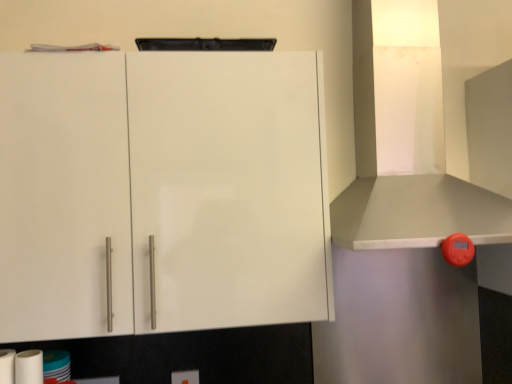
Question: Is white matte paper towel at lower left, the 2th paper towel in the right-to-left sequence, at the back of white matte paper towel at lower left, arranged as the first paper towel when viewed from the right?

Choices:
 (A) yes
 (B) no

Answer: (B)

Question: Is white matte paper towel at lower left, the 2th paper towel viewed from the left, further to the viewer compared to white matte paper towel at lower left, the 1th paper towel from the left?

Choices:
 (A) yes
 (B) no

Answer: (A)

Question: From a real-world perspective, is white matte paper towel at lower left, arranged as the first paper towel when viewed from the right, on white matte paper towel at lower left, the 1th paper towel from the left?

Choices:
 (A) no
 (B) yes

Answer: (B)

Question: Is white matte paper towel at lower left, the 2th paper towel viewed from the left, wider than white matte paper towel at lower left, the 1th paper towel from the left?

Choices:
 (A) no
 (B) yes

Answer: (A)

Question: Is white matte paper towel at lower left, arranged as the first paper towel when viewed from the right, far away from white matte paper towel at lower left, the 2th paper towel in the right-to-left sequence?

Choices:
 (A) no
 (B) yes

Answer: (A)

Question: Considering the relative positions of white matte paper towel at lower left, the 2th paper towel viewed from the left, and white matte paper towel at lower left, the 1th paper towel from the left, in the image provided, is white matte paper towel at lower left, the 2th paper towel viewed from the left, to the left of white matte paper towel at lower left, the 1th paper towel from the left, from the viewer's perspective?

Choices:
 (A) no
 (B) yes

Answer: (A)

Question: Is white glossy cabinet at upper left oriented away from white glossy exhaust hood at upper right?

Choices:
 (A) yes
 (B) no

Answer: (B)

Question: Is white glossy cabinet at upper left with white glossy exhaust hood at upper right?

Choices:
 (A) yes
 (B) no

Answer: (B)

Question: Considering the relative sizes of white glossy cabinet at upper left and white glossy exhaust hood at upper right in the image provided, is white glossy cabinet at upper left smaller than white glossy exhaust hood at upper right?

Choices:
 (A) yes
 (B) no

Answer: (A)

Question: Can you confirm if white glossy cabinet at upper left is shorter than white glossy exhaust hood at upper right?

Choices:
 (A) no
 (B) yes

Answer: (B)

Question: Does white glossy cabinet at upper left have a lesser width compared to white glossy exhaust hood at upper right?

Choices:
 (A) no
 (B) yes

Answer: (B)

Question: From the image's perspective, is white glossy cabinet at upper left beneath white glossy exhaust hood at upper right?

Choices:
 (A) yes
 (B) no

Answer: (A)

Question: Is white matte paper towel at lower left, the 2th paper towel viewed from the left, far from white glossy toilet paper at lower left?

Choices:
 (A) yes
 (B) no

Answer: (B)